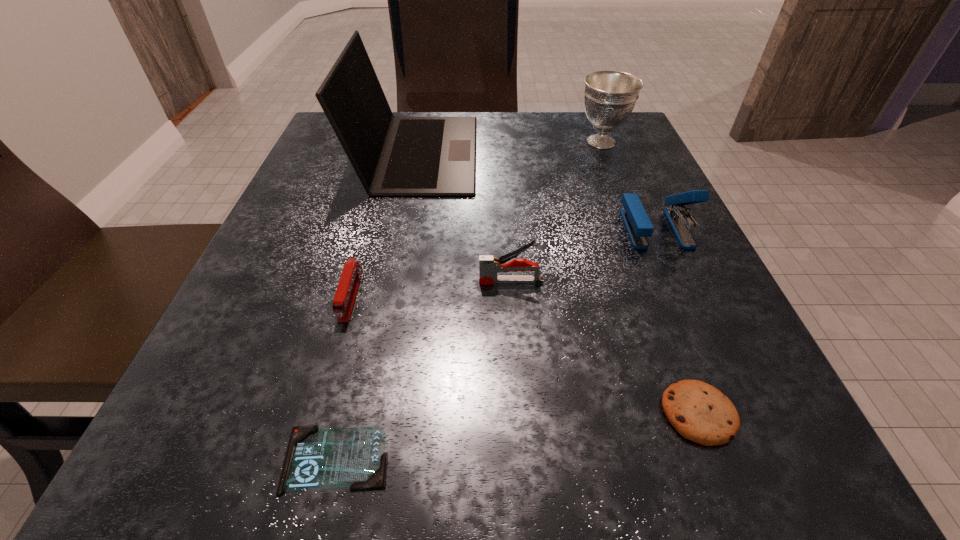
Locate an element on the screen. This screenshot has width=960, height=540. the second closest stapler to the leftmost stapler is located at coordinates (638, 225).

Find the location of a particular element. vacant space that satisfies the following two spatial constraints: 1. on the handle side of the second stapler from right to left; 2. on the back side of the second shortest object is located at coordinates (520, 414).

At what (x,y) coordinates should I click in order to perform the action: click on vacant area that satisfies the following two spatial constraints: 1. on the screen of the laptop; 2. on the right side of the farthest stapler. Please return your answer as a coordinate pair (x, y). This screenshot has height=540, width=960. Looking at the image, I should click on (402, 228).

Locate an element on the screen. This screenshot has width=960, height=540. free space that satisfies the following two spatial constraints: 1. on the front-facing side of the shortest stapler; 2. on the right side of the second shortest object is located at coordinates (318, 414).

Identify the location of vacant space that satisfies the following two spatial constraints: 1. on the back side of the rightmost stapler; 2. on the screen of the laptop. (622, 153).

This screenshot has height=540, width=960. Find the location of `blank space that satisfies the following two spatial constraints: 1. on the screen of the laptop; 2. on the back side of the rightmost stapler`. blank space that satisfies the following two spatial constraints: 1. on the screen of the laptop; 2. on the back side of the rightmost stapler is located at coordinates (402, 228).

The image size is (960, 540). What are the coordinates of `free point that satisfies the following two spatial constraints: 1. on the front-facing side of the cookie; 2. on the left side of the leftmost stapler` in the screenshot? It's located at (318, 414).